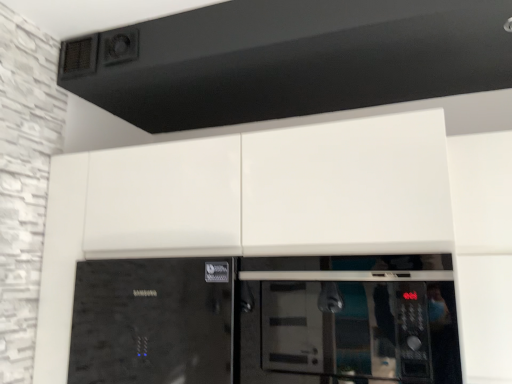
Question: From a real-world perspective, is glossy white cabinet at center positioned above or below black glass microwave at center?

Choices:
 (A) above
 (B) below

Answer: (A)

Question: Is glossy white cabinet at center situated inside black glass microwave at center or outside?

Choices:
 (A) outside
 (B) inside

Answer: (A)

Question: Based on their relative distances, which object is farther from the glossy white cabinet at center?

Choices:
 (A) black glass microwave at center
 (B) black textured exhaust hood at upper center

Answer: (B)

Question: Estimate the real-world distances between objects in this image. Which object is closer to the glossy white cabinet at center?

Choices:
 (A) black textured exhaust hood at upper center
 (B) black glass microwave at center

Answer: (B)